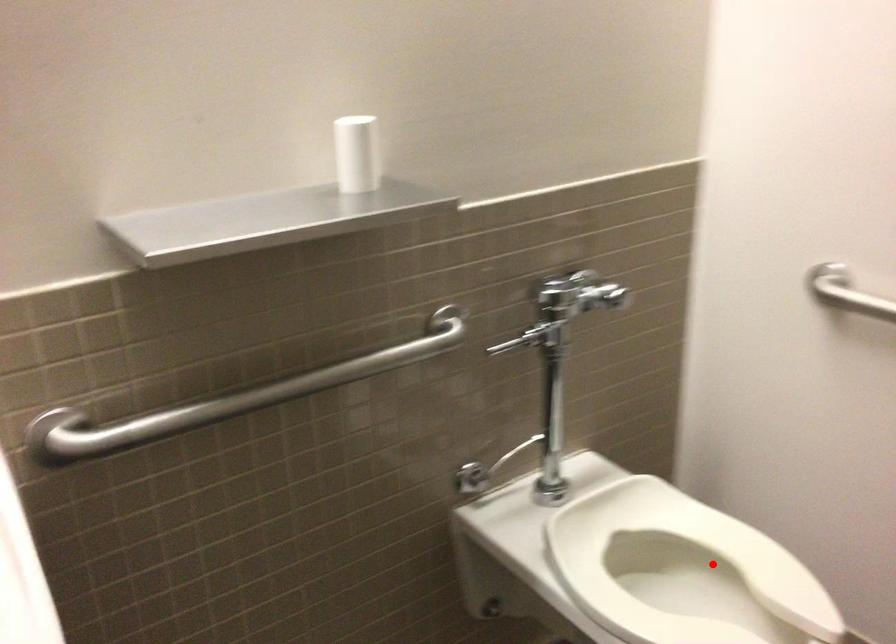
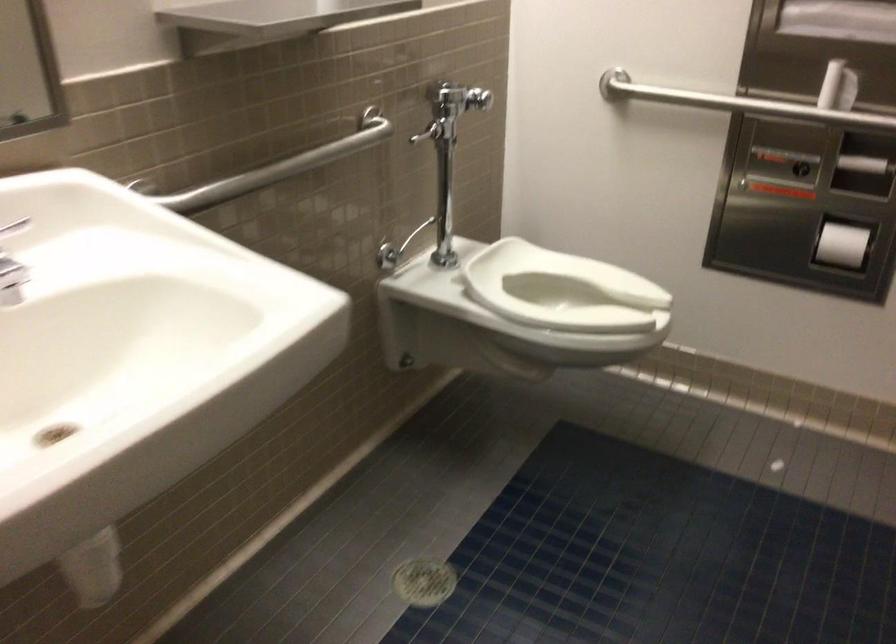
Where in the second image is the point corresponding to the highlighted location from the first image?

(563, 290)